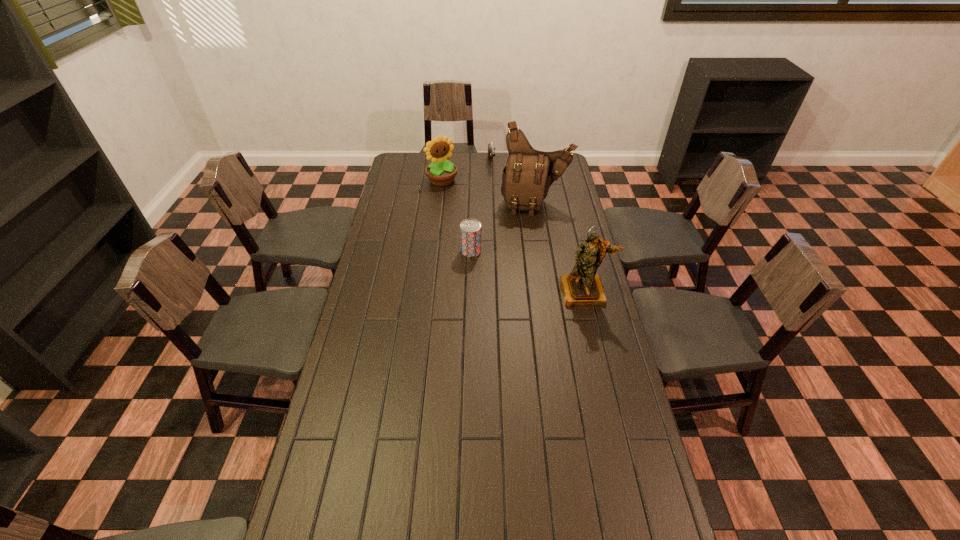
Locate an element on the screen. Image resolution: width=960 pixels, height=540 pixels. pistol located in the far edge section of the desktop is located at coordinates (491, 147).

This screenshot has height=540, width=960. What are the coordinates of `sunflower that is at the far edge` in the screenshot? It's located at (441, 172).

I want to click on figurine that is at the right edge, so click(x=583, y=286).

This screenshot has width=960, height=540. Identify the location of shoulder bag present at the right edge. (528, 174).

In the image, there is a desktop. Where is `blank space at the far edge`? This screenshot has height=540, width=960. blank space at the far edge is located at coordinates (503, 164).

The image size is (960, 540). Find the location of `vacant region at the near edge of the desktop`. vacant region at the near edge of the desktop is located at coordinates (506, 501).

Where is `vacant area at the left edge`? vacant area at the left edge is located at coordinates (353, 474).

Locate an element on the screen. The image size is (960, 540). vacant space at the far left corner is located at coordinates pos(416,158).

Find the location of `free space between the nearest object and the third object from left to right`. free space between the nearest object and the third object from left to right is located at coordinates (538, 227).

What are the coordinates of `free space between the tallest object and the fourth object from right to left` in the screenshot? It's located at (503, 227).